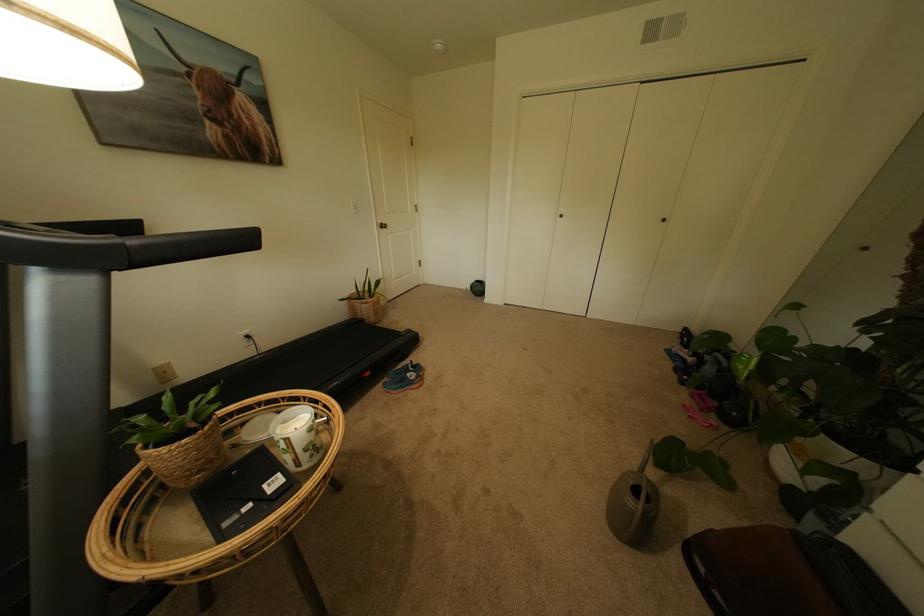
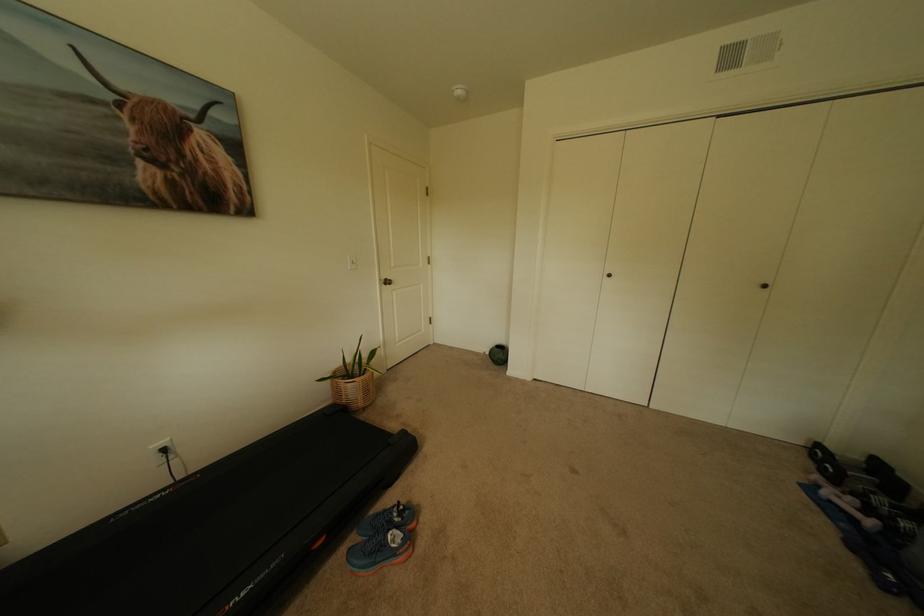
Find the pixel in the second image that matches the point at 420,369 in the first image.

(407, 517)